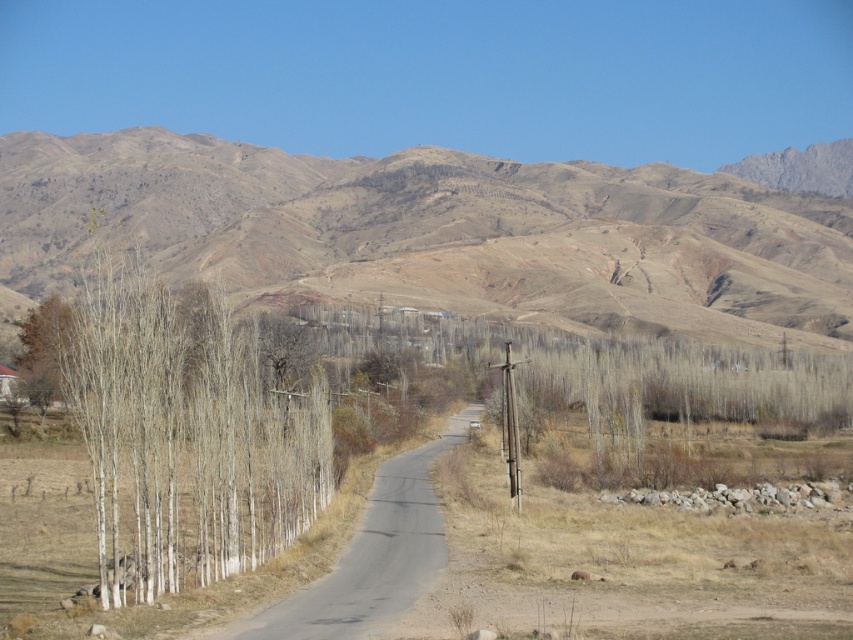
Can you confirm if white smooth trees at left is positioned to the right of brown matte tree at left?

Correct, you'll find white smooth trees at left to the right of brown matte tree at left.

Does white smooth trees at left appear over brown matte tree at left?

No, white smooth trees at left is not above brown matte tree at left.

Find the location of `white smooth trees at left`. white smooth trees at left is located at coordinates (183, 429).

Between brown/dry soil hill at upper center and brown matte tree at left, which one is positioned higher?

brown/dry soil hill at upper center is above.

Who is positioned more to the left, brown/dry soil hill at upper center or brown matte tree at left?

brown matte tree at left is more to the left.

Is point (798, 211) more distant than point (27, 340)?

Yes, it is.

Find the location of a particular element. The image size is (853, 640). brown/dry soil hill at upper center is located at coordinates (438, 232).

Can you confirm if brown/dry soil hill at upper center is wider than white smooth trees at left?

Correct, the width of brown/dry soil hill at upper center exceeds that of white smooth trees at left.

Does brown/dry soil hill at upper center appear on the left side of white smooth trees at left?

Correct, you'll find brown/dry soil hill at upper center to the left of white smooth trees at left.

The width and height of the screenshot is (853, 640). In order to click on brown/dry soil hill at upper center in this screenshot , I will do `click(438, 232)`.